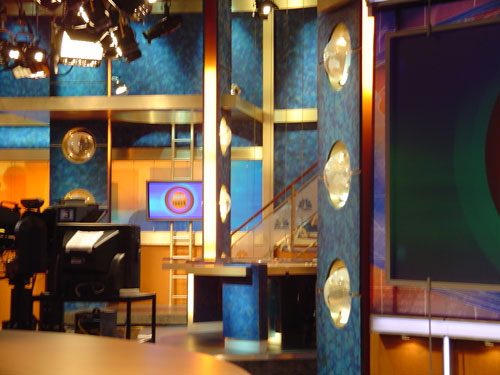
This screenshot has height=375, width=500. Find the location of `stairs`. stairs is located at coordinates (278, 249).